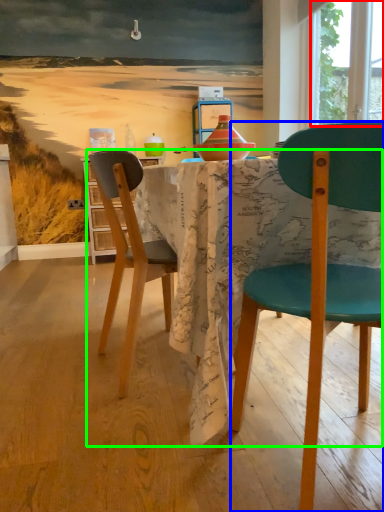
Question: Which object is the closest to the window screen (highlighted by a red box)? Choose among these: chair (highlighted by a blue box) or kitchen & dining room table (highlighted by a green box).

Choices:
 (A) chair
 (B) kitchen & dining room table

Answer: (B)